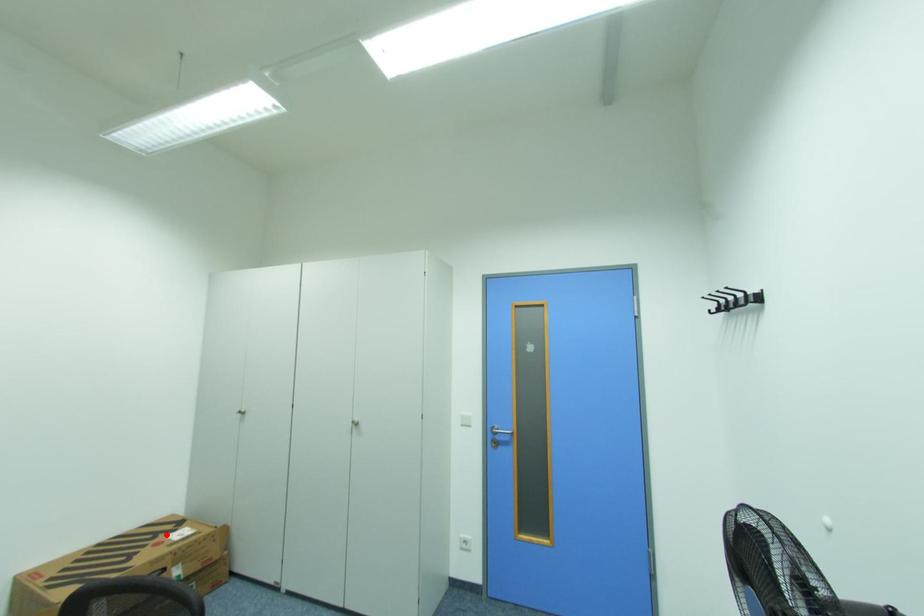
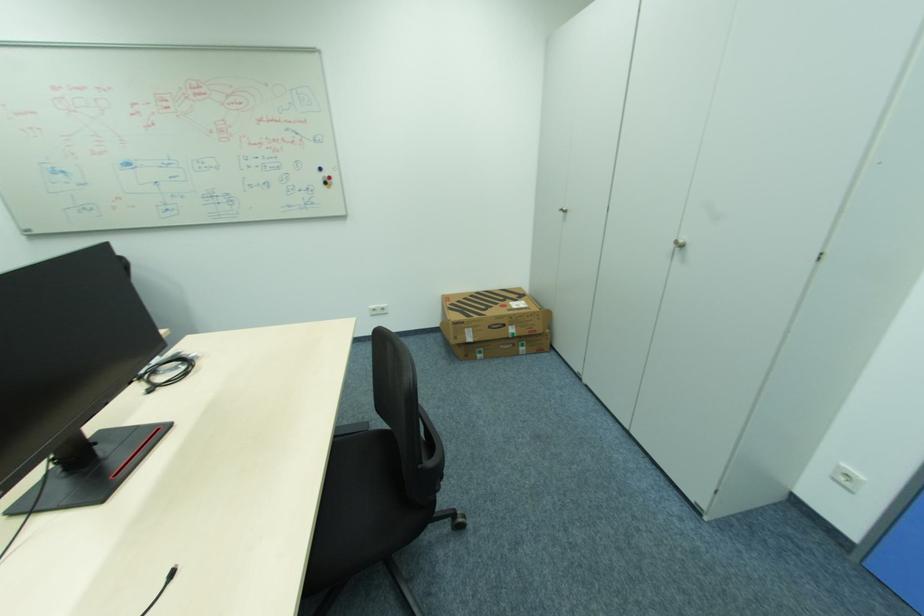
Where in the second image is the point corresponding to the highlighted location from the first image?

(513, 300)